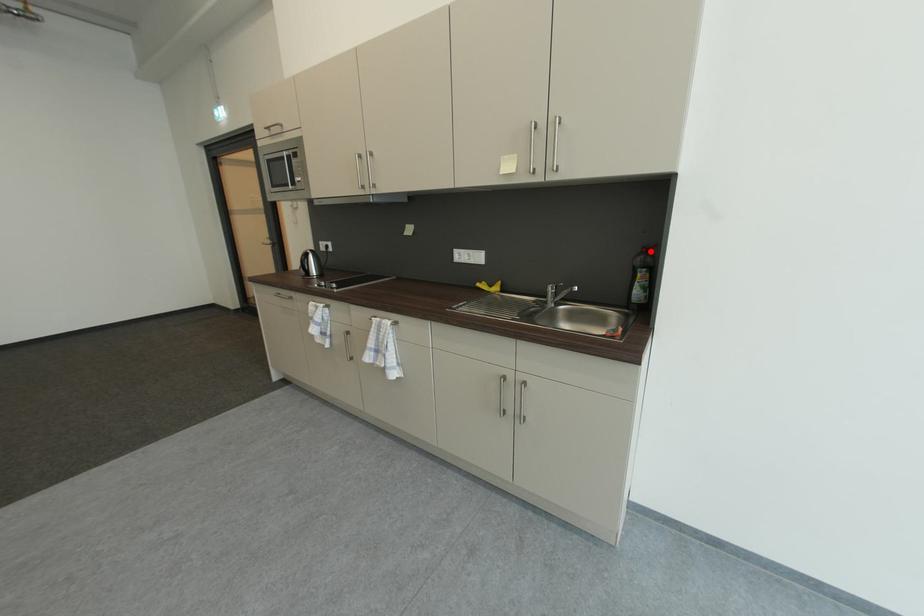
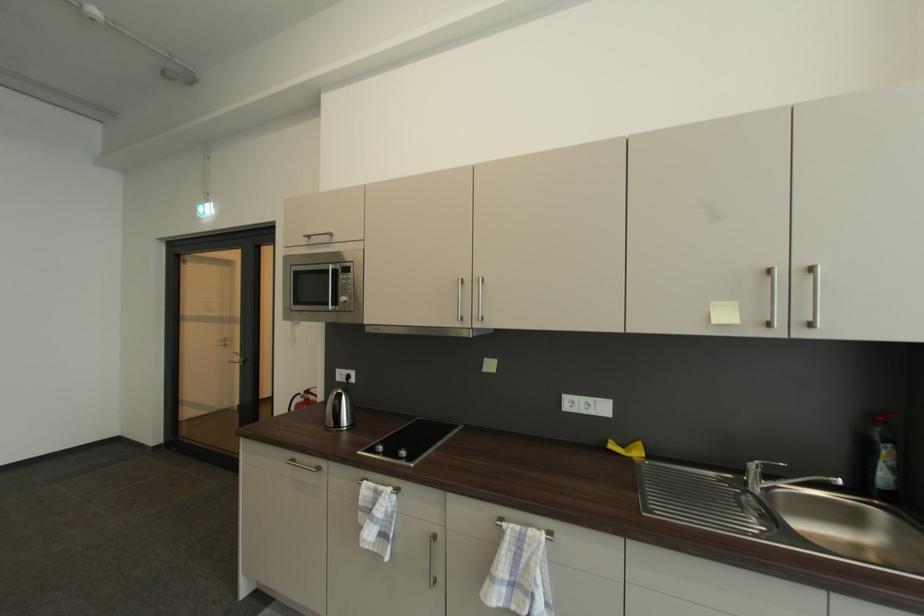
Find the pixel in the second image that matches the highlighted location in the first image.

(885, 419)